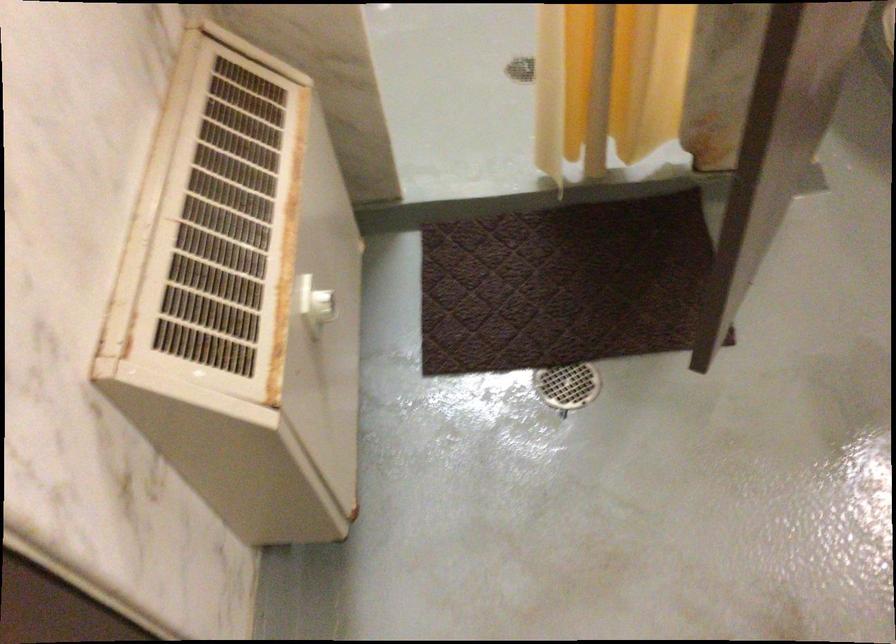
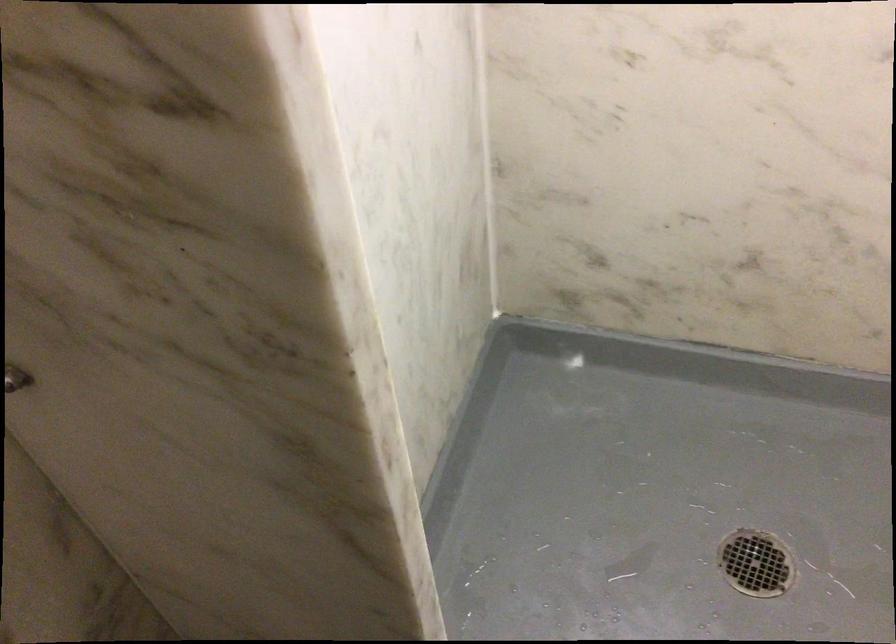
Question: In a continuous first-person perspective shot, in which direction is the camera moving?

Choices:
 (A) Left
 (B) Right
 (C) Forward
 (D) Backward

Answer: (C)